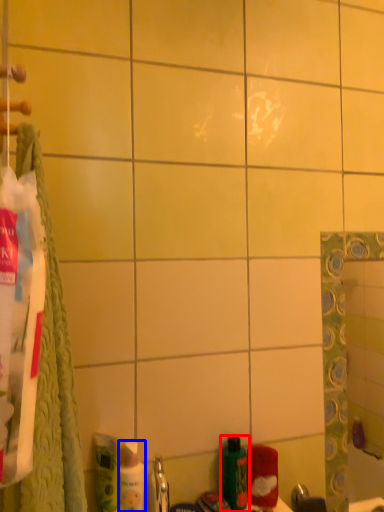
Question: Which point is closer to the camera, bottle (highlighted by a red box) or mouthwash (highlighted by a blue box)?

Choices:
 (A) bottle
 (B) mouthwash

Answer: (B)